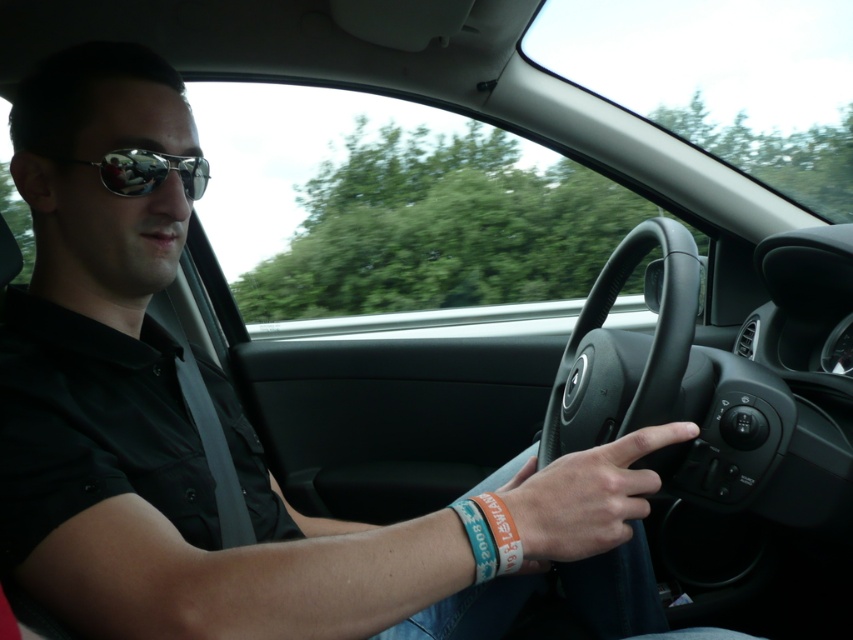
Can you confirm if smooth leather hand at center is bigger than teal fabric wristband at lower center?

Yes, smooth leather hand at center is bigger than teal fabric wristband at lower center.

Can you confirm if smooth leather hand at center is positioned above teal fabric wristband at lower center?

Yes.

Does point (622, 452) come behind point (473, 513)?

That is True.

At what (x,y) coordinates should I click in order to perform the action: click on smooth leather hand at center. Please return your answer as a coordinate pair (x, y). This screenshot has width=853, height=640. Looking at the image, I should click on (585, 497).

Does smooth leather hand at center have a smaller size compared to shiny reflective sunglasses at left?

Actually, smooth leather hand at center might be larger than shiny reflective sunglasses at left.

Between smooth leather hand at center and shiny reflective sunglasses at left, which one has more height?

With more height is smooth leather hand at center.

Which is in front, point (563, 481) or point (149, 168)?

Point (563, 481) is in front.

Locate an element on the screen. This screenshot has height=640, width=853. smooth leather hand at center is located at coordinates (585, 497).

This screenshot has height=640, width=853. What do you see at coordinates (625, 349) in the screenshot?
I see `black matte steering wheel at center` at bounding box center [625, 349].

This screenshot has height=640, width=853. Find the location of `black matte steering wheel at center`. black matte steering wheel at center is located at coordinates (625, 349).